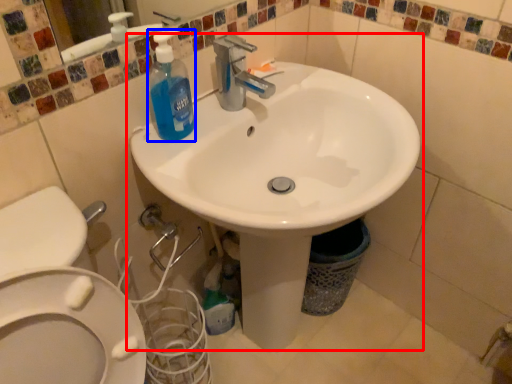
Question: Which point is further to the camera, sink (highlighted by a red box) or cleaning product (highlighted by a blue box)?

Choices:
 (A) sink
 (B) cleaning product

Answer: (B)